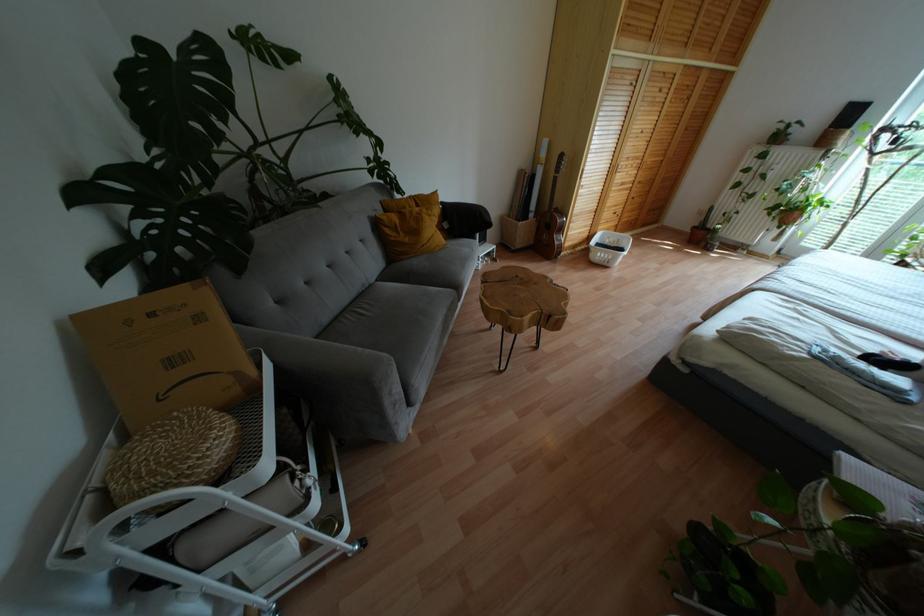
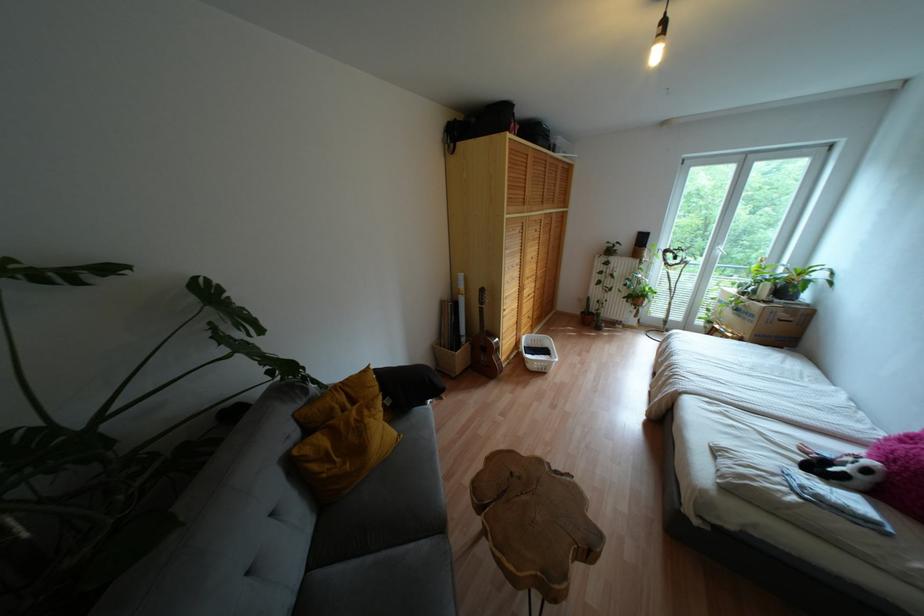
In a continuous first-person perspective shot, in which direction is the camera moving?

The cameraman moved toward left, forward.